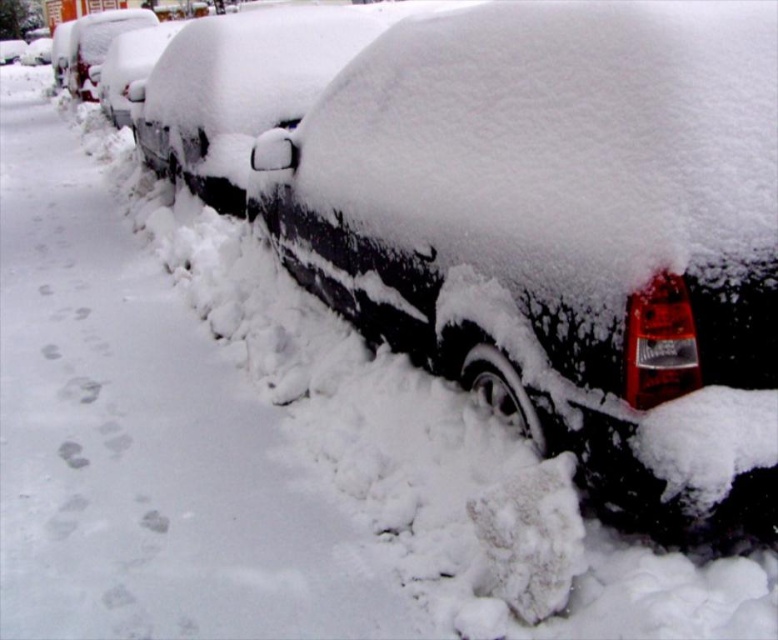
Question: Does black matte car at center have a greater width compared to snow-covered car at upper left?

Choices:
 (A) yes
 (B) no

Answer: (A)

Question: Does black matte car at center have a larger size compared to snow-covered car at upper left?

Choices:
 (A) yes
 (B) no

Answer: (A)

Question: Does black matte car at center have a greater width compared to snow-covered car at upper left?

Choices:
 (A) yes
 (B) no

Answer: (A)

Question: Which point is farther to the camera?

Choices:
 (A) (100, 28)
 (B) (668, 516)

Answer: (A)

Question: Which of the following is the closest to the observer?

Choices:
 (A) black matte car at center
 (B) snow-covered car at upper left

Answer: (A)